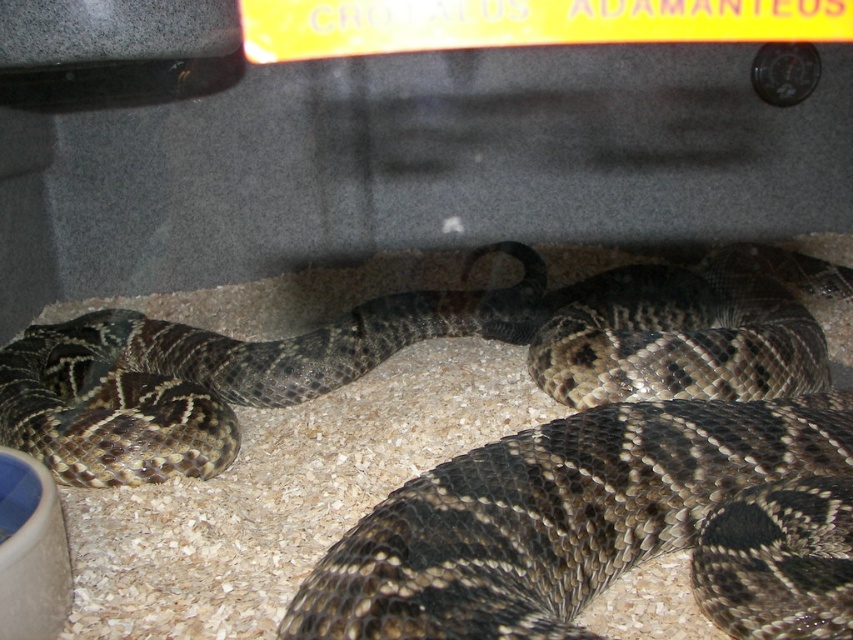
You are standing in front of the terrarium and see two points marked on the glass. The first point is at position point (x=630, y=371) and the second is at point (x=16, y=372). Which point is closer to you?

Point (x=630, y=371) is in front of point (x=16, y=372), so the first point is closer to you.

You are a zookeeper checking the enclosure. You need to locate the shiny brown snake at center. Where is it in relation to the brown speckled snake at center?

The shiny brown snake at center is positioned under the brown speckled snake at center.